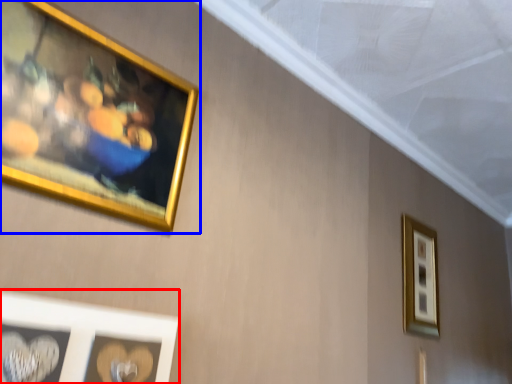
Question: Among these objects, which one is nearest to the camera, picture frame (highlighted by a red box) or picture frame (highlighted by a blue box)?

Choices:
 (A) picture frame
 (B) picture frame

Answer: (A)